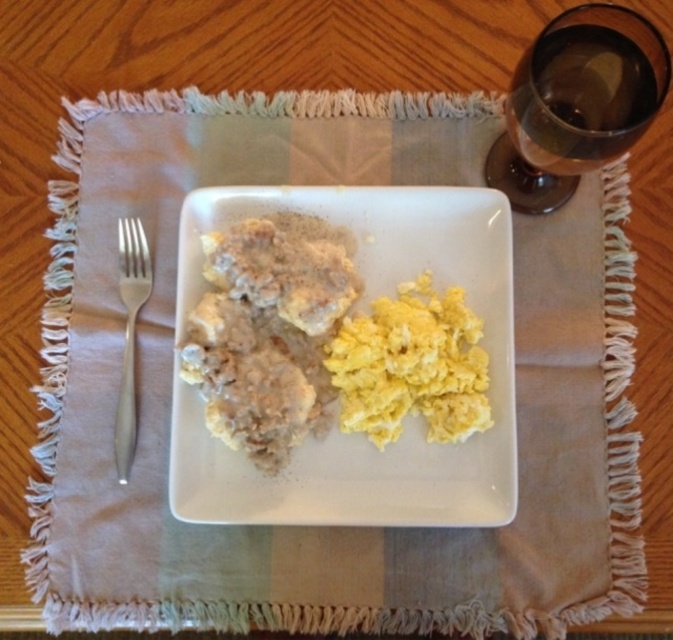
You are a chef trying to place a new garnish on the plate. The garnish requires a space wider than the silver metallic fork at left. Can you place it on the yellow scrambled eggs at center?

The yellow scrambled eggs at center has a width larger than the silver metallic fork at left, so yes, you can place the garnish there as it provides sufficient space.

You are a person sitting at the table in the image. You want to pick up the transparent glass at upper right to take a drink. Can you reach it without moving the white matte plate at center?

The transparent glass at upper right is behind white matte plate at center, so you cannot reach it without moving the plate first.

You are setting the table for a dinner party and need to place a decorative centerpiece between the white matte plate at center and the transparent glass at upper right. Based on their positions, where should you place the centerpiece?

The white matte plate at center is positioned on the left side of the transparent glass at upper right, so the centerpiece should be placed between them, centered between the white matte plate at center and the transparent glass at upper right.